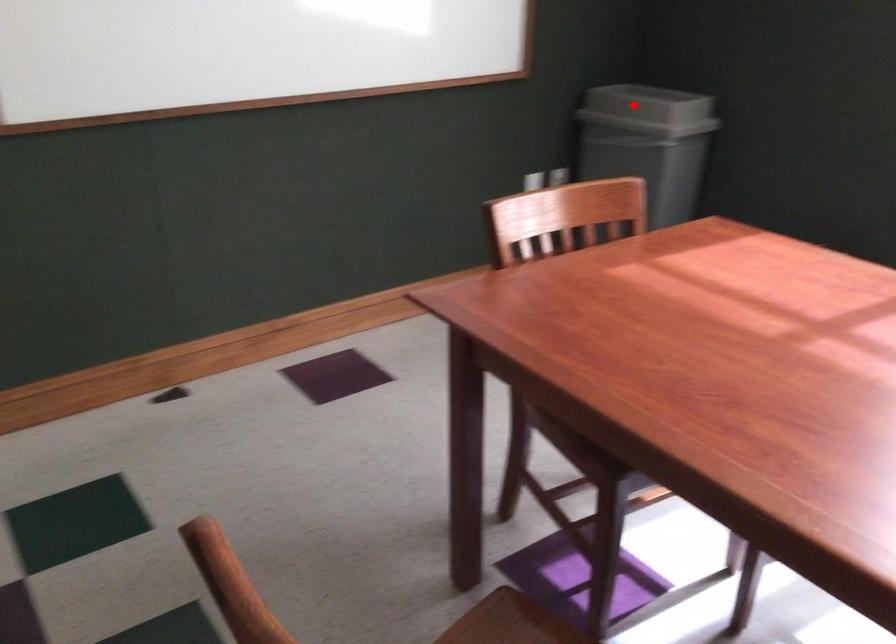
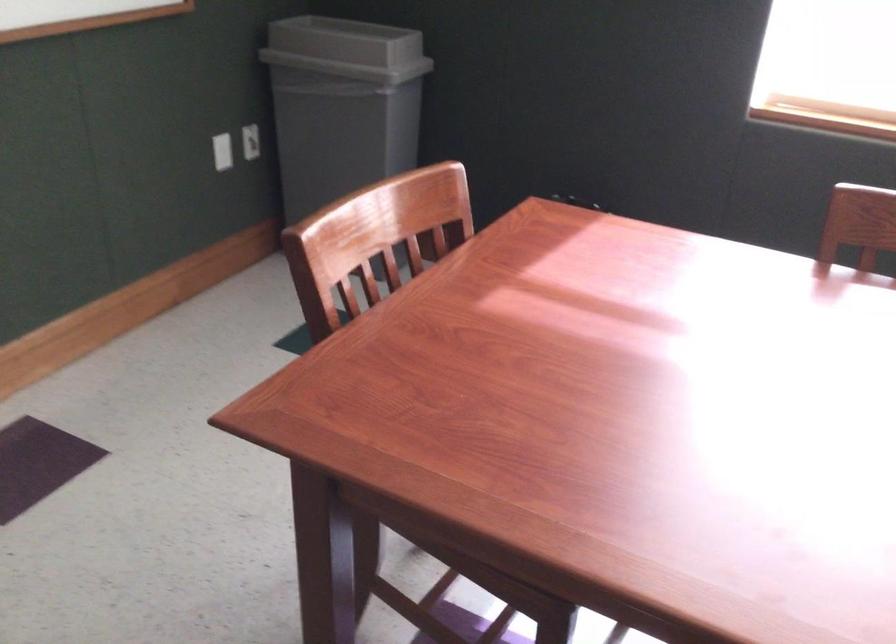
Question: I am providing you with two images of the same scene from different viewpoints. A red point is shown in image1. For the corresponding object point in image2, is it positioned nearer or farther from the camera?

Choices:
 (A) Nearer
 (B) Farther

Answer: (A)